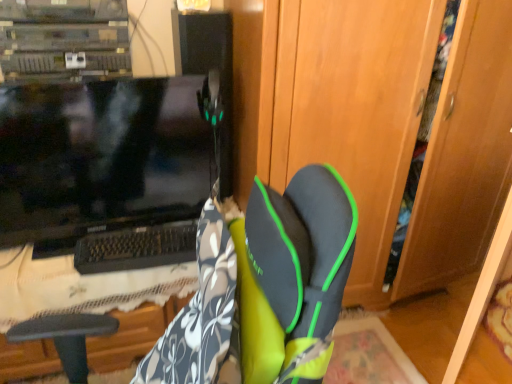
Question: Do you think black glossy monitor at left is within wooden dresser at center, or outside of it?

Choices:
 (A) inside
 (B) outside

Answer: (B)

Question: Visually, is black glossy monitor at left positioned to the left or to the right of wooden dresser at center?

Choices:
 (A) left
 (B) right

Answer: (A)

Question: In the image, is black glossy monitor at left positioned in front of or behind wooden dresser at center?

Choices:
 (A) front
 (B) behind

Answer: (B)

Question: Considering the positions of wooden dresser at center and black glossy monitor at left in the image, is wooden dresser at center wider or thinner than black glossy monitor at left?

Choices:
 (A) thin
 (B) wide

Answer: (B)

Question: Which is correct: wooden dresser at center is inside black glossy monitor at left, or outside of it?

Choices:
 (A) inside
 (B) outside

Answer: (B)

Question: Is wooden dresser at center to the left or to the right of black glossy monitor at left in the image?

Choices:
 (A) right
 (B) left

Answer: (A)

Question: Is wooden dresser at center bigger or smaller than black glossy monitor at left?

Choices:
 (A) small
 (B) big

Answer: (B)